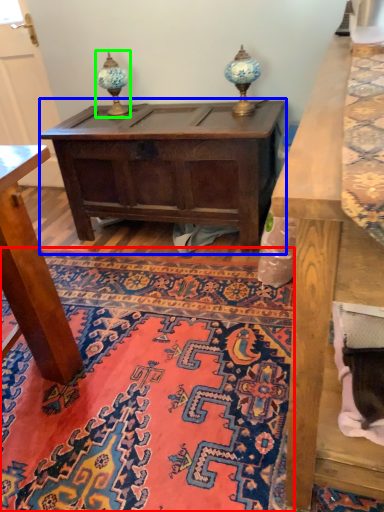
Question: Which object is the farthest from mat (highlighted by a red box)? Choose among these: table (highlighted by a blue box) or table lamp (highlighted by a green box).

Choices:
 (A) table
 (B) table lamp

Answer: (B)